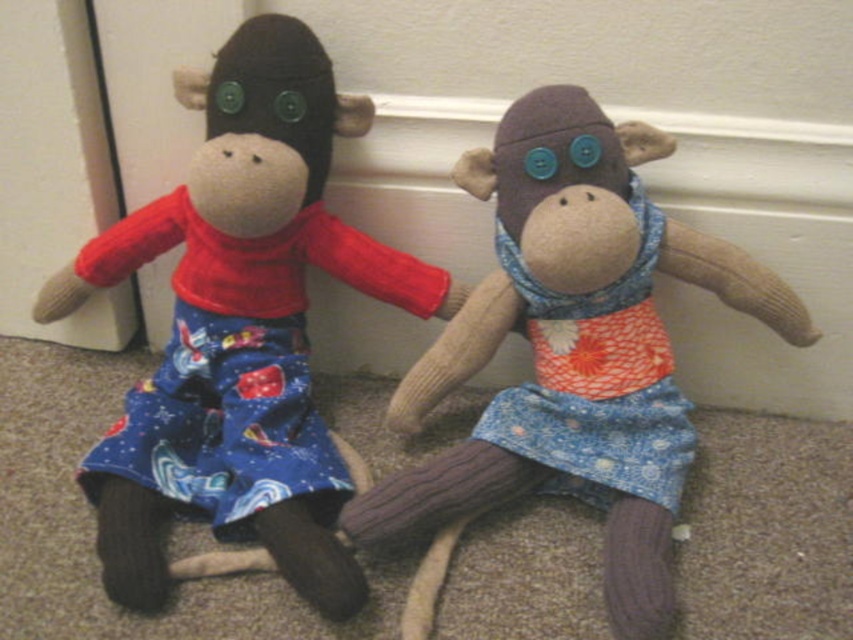
Question: Is matte red sweater at left to the left of matte fabric monkey at left from the viewer's perspective?

Choices:
 (A) yes
 (B) no

Answer: (A)

Question: Which point appears farthest from the camera in this image?

Choices:
 (A) (198, 156)
 (B) (573, 429)

Answer: (B)

Question: Is matte red sweater at left positioned behind matte fabric monkey at left?

Choices:
 (A) no
 (B) yes

Answer: (B)

Question: Can you confirm if matte red sweater at left is positioned below matte fabric monkey at left?

Choices:
 (A) no
 (B) yes

Answer: (A)

Question: Which object is farther from the camera taking this photo?

Choices:
 (A) matte red sweater at left
 (B) matte fabric monkey at left

Answer: (A)